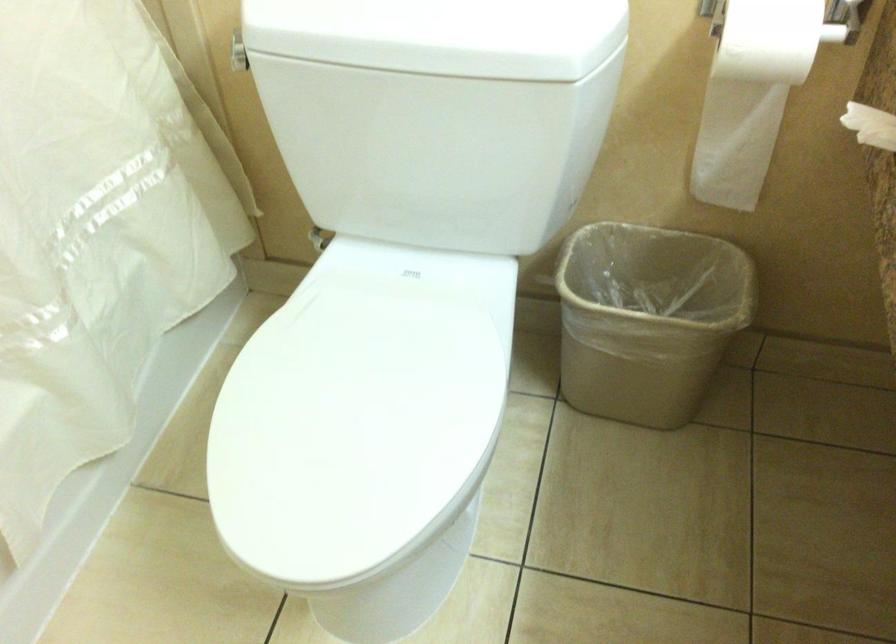
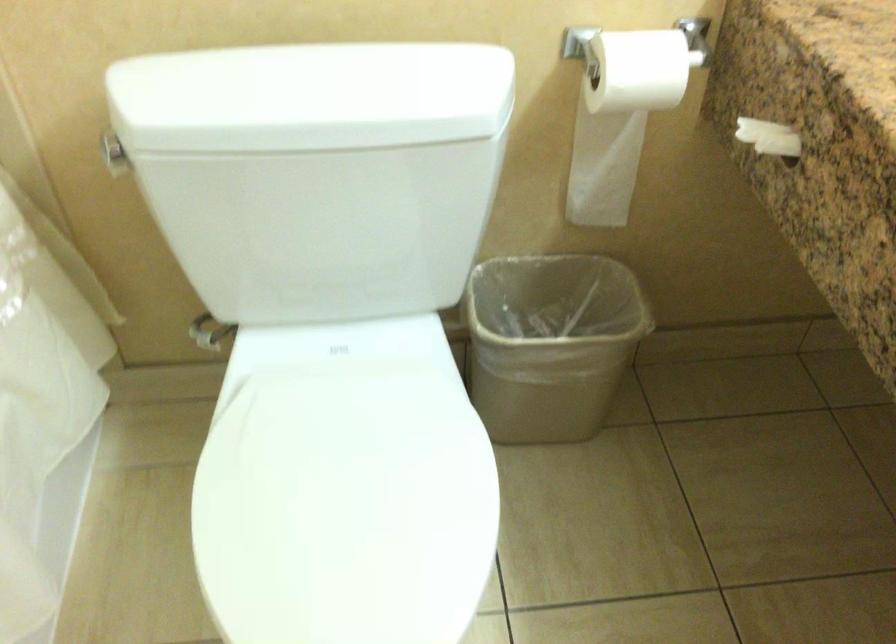
Question: The first image is from the beginning of the video and the second image is from the end. How did the camera likely rotate when shooting the video?

Choices:
 (A) Left
 (B) Right
 (C) Up
 (D) Down

Answer: (B)